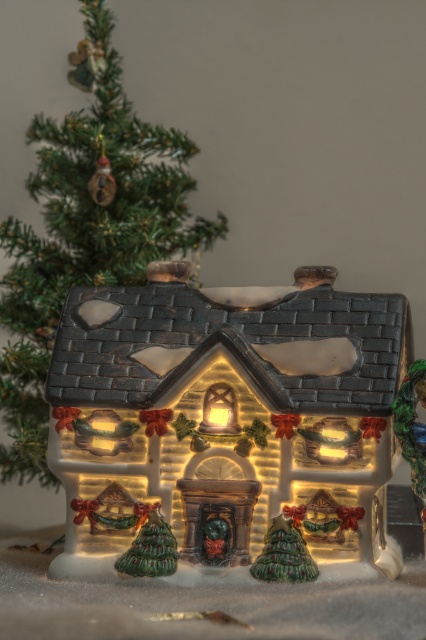
Question: Can you confirm if matte ceramic house at center is positioned above green textured christmas tree at upper left?

Choices:
 (A) yes
 (B) no

Answer: (B)

Question: Does matte ceramic house at center have a larger size compared to green textured christmas tree at upper left?

Choices:
 (A) yes
 (B) no

Answer: (B)

Question: Which point is farther to the camera?

Choices:
 (A) click(101, 241)
 (B) click(360, 355)

Answer: (A)

Question: Can you confirm if matte ceramic house at center is thinner than green textured christmas tree at upper left?

Choices:
 (A) yes
 (B) no

Answer: (B)